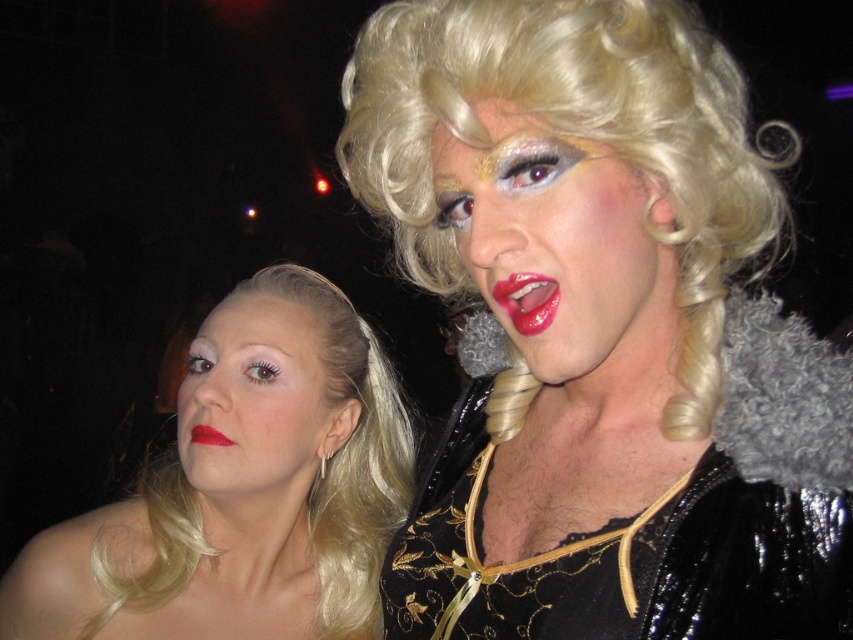
Does glossy red lips at center lie behind matte red lipstick at lower left?

No, glossy red lips at center is closer to the viewer.

Is point (531, 307) in front of point (196, 435)?

Yes, it is.

Who is more forward, (497,300) or (198,433)?

Point (497,300)

Find the location of `glossy red lips at center`. glossy red lips at center is located at coordinates (527, 300).

Is shiny gold wig at center taller than glossy red lips at center?

Yes.

Between point (467, 163) and point (527, 276), which one is positioned in front?

Point (527, 276)

The width and height of the screenshot is (853, 640). What do you see at coordinates (561, 252) in the screenshot?
I see `shiny gold wig at center` at bounding box center [561, 252].

What are the coordinates of `shiny gold wig at center` in the screenshot? It's located at (561, 252).

Consider the image. Is the position of shiny gold wig at center less distant than that of matte skin face at lower left?

Yes, shiny gold wig at center is in front of matte skin face at lower left.

How far apart are shiny gold wig at center and matte skin face at lower left?

The distance of shiny gold wig at center from matte skin face at lower left is 13.30 inches.

Does point (531, 116) lie behind point (279, 483)?

No.

The width and height of the screenshot is (853, 640). In order to click on shiny gold wig at center in this screenshot , I will do `click(561, 252)`.